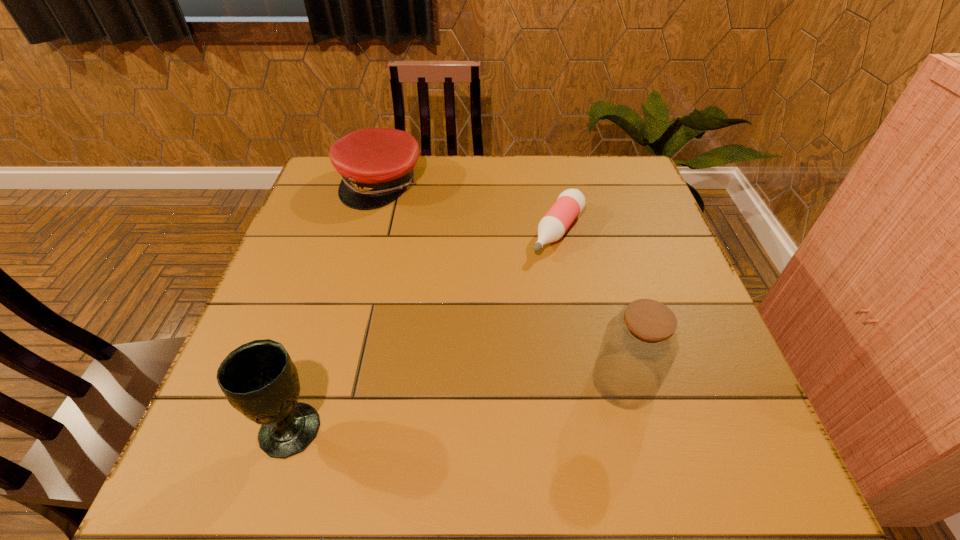
You are a GUI agent. You are given a task and a screenshot of the screen. Output one action in this format:
    pyautogui.click(x=<x>, y=<y>)
    Task: Click on the chalice
    This screenshot has height=540, width=960.
    Given the screenshot: What is the action you would take?
    pyautogui.click(x=259, y=379)

Where is `jar`? jar is located at coordinates (640, 344).

The image size is (960, 540). Identify the location of cap. (376, 164).

Where is `bottle`? The width and height of the screenshot is (960, 540). bottle is located at coordinates (570, 203).

Identify the location of free space located on the back of the chalice. (333, 291).

This screenshot has height=540, width=960. In order to click on free space located on the back of the jar in this screenshot , I will do `click(585, 229)`.

Find the location of a particular element. vacant space situated 0.360m on the front-facing side of the second shortest object is located at coordinates (441, 296).

You are a GUI agent. You are given a task and a screenshot of the screen. Output one action in this format:
    pyautogui.click(x=<x>, y=<y>)
    Task: Click on the vacant space located 0.200m on the front-facing side of the second shortest object
    The image size is (960, 540).
    Given the screenshot: What is the action you would take?
    pyautogui.click(x=417, y=253)

The width and height of the screenshot is (960, 540). Find the location of `free spot located on the front-facing side of the second shortest object`. free spot located on the front-facing side of the second shortest object is located at coordinates (398, 218).

The image size is (960, 540). I want to click on free space located 0.190m with the cap open on the bottle, so click(510, 308).